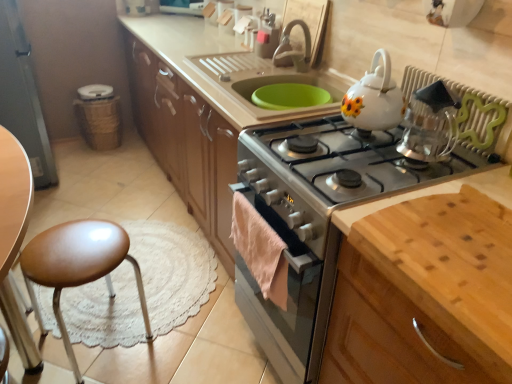
Where is `free point below brown leather stool at lower left (from a real-world perspective)`? Image resolution: width=512 pixels, height=384 pixels. free point below brown leather stool at lower left (from a real-world perspective) is located at coordinates (104, 327).